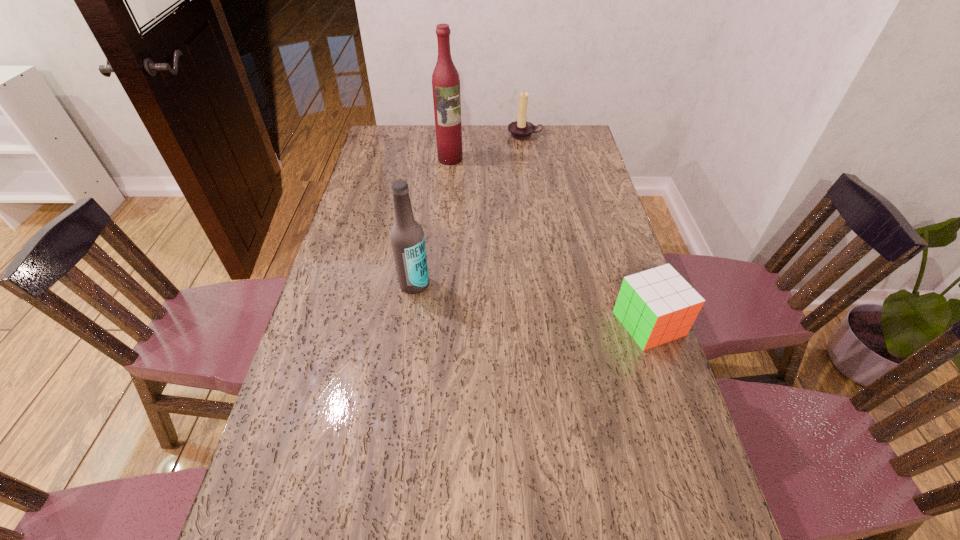
You are a GUI agent. You are given a task and a screenshot of the screen. Output one action in this format:
    pyautogui.click(x=<x>, y=<y>)
    Task: Click on the free space on the desktop that is between the third shortest object and the nearest object and is positioned on the wick of the candle holder
    The height and width of the screenshot is (540, 960).
    Given the screenshot: What is the action you would take?
    pyautogui.click(x=527, y=303)

Identify the location of vacant space on the desktop that is between the second tallest object and the shortest object and is positioned on the label of the third nearest object. Image resolution: width=960 pixels, height=540 pixels. (550, 307).